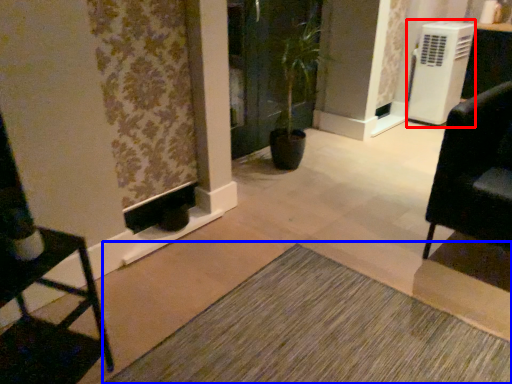
Question: Among these objects, which one is nearest to the camera, air conditioning (highlighted by a red box) or doormat (highlighted by a blue box)?

Choices:
 (A) air conditioning
 (B) doormat

Answer: (B)